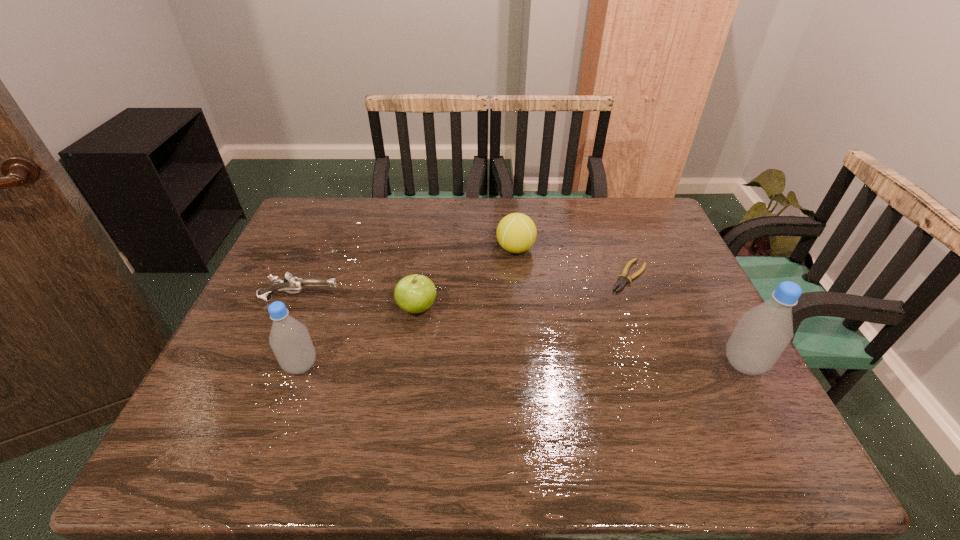
Please point a spot to place another bottle for symmetrical spacing. Please provide its 2D coordinates. Your answer should be formatted as a tuple, i.e. [(x, y)], where the tuple contains the x and y coordinates of a point satisfying the conditions above.

[(522, 364)]